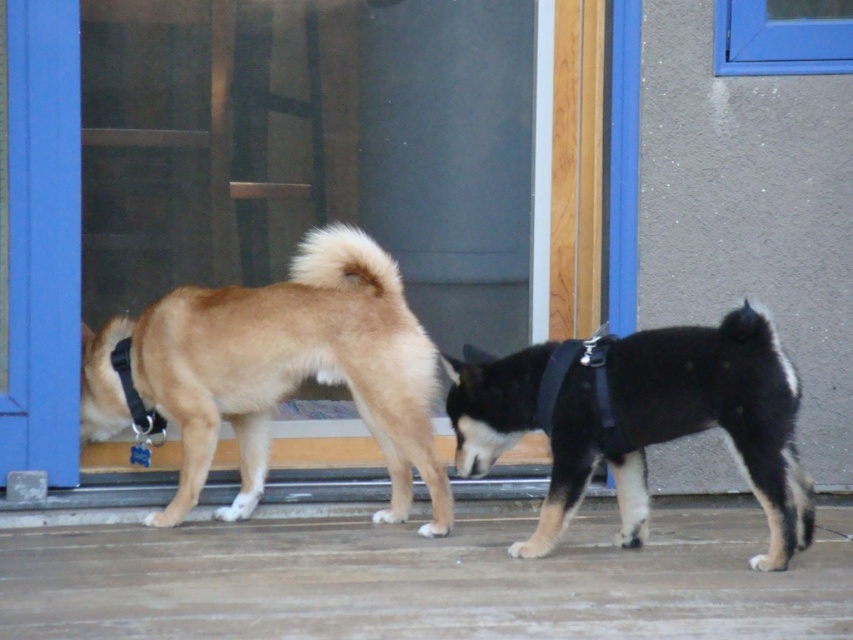
At what (x,y) coordinates should I click in order to perform the action: click on light brown fur at left. Please return your answer as a coordinate pair (x, y). The width and height of the screenshot is (853, 640). Looking at the image, I should click on (277, 371).

Image resolution: width=853 pixels, height=640 pixels. Describe the element at coordinates (277, 371) in the screenshot. I see `light brown fur at left` at that location.

The image size is (853, 640). What are the coordinates of `light brown fur at left` in the screenshot? It's located at (277, 371).